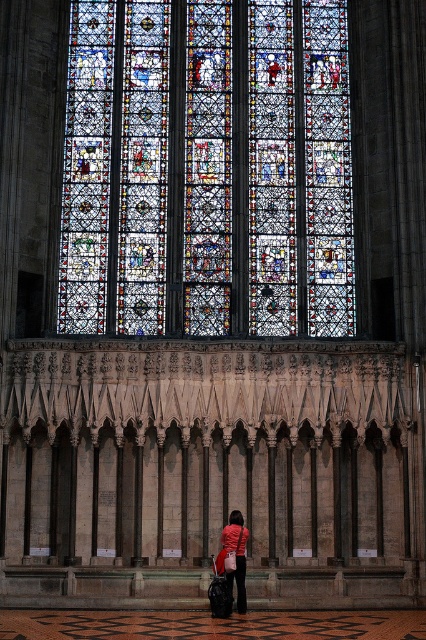
Does multicolored stained glass at center have a larger size compared to matte red jacket at center?

Yes.

Who is more distant from viewer, (138, 220) or (242, 566)?

Positioned behind is point (138, 220).

Is point (154, 17) more distant than point (238, 566)?

Yes.

In order to click on multicolored stained glass at center in this screenshot , I will do `click(207, 170)`.